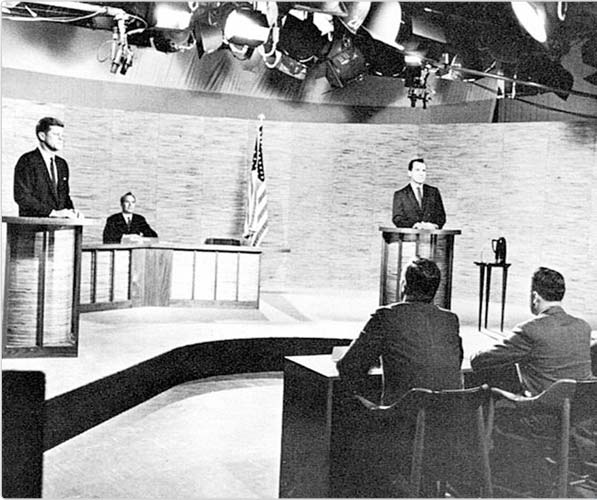
Identify the location of desk. (325, 372), (464, 368), (593, 355), (318, 448), (147, 272).